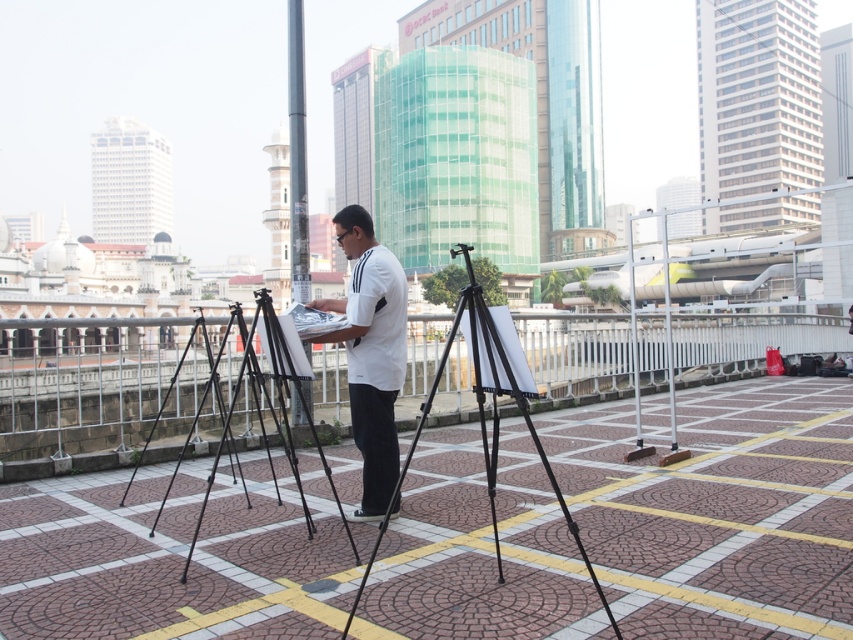
Is white matte shirt at center positioned behind black matte tripod at center?

Yes.

Does white matte shirt at center come in front of black matte tripod at center?

No, white matte shirt at center is behind black matte tripod at center.

Which is in front, point (368, 396) or point (592, 580)?

Point (592, 580) is more forward.

Where is `white matte shirt at center`? The image size is (853, 640). white matte shirt at center is located at coordinates (370, 353).

Who is taller, white matte shirt at center or black metal tripod at center?

With more height is white matte shirt at center.

Can you confirm if white matte shirt at center is taller than black metal tripod at center?

Indeed, white matte shirt at center has a greater height compared to black metal tripod at center.

Between point (372, 308) and point (276, 378), which one is positioned in front?

Point (372, 308) is more forward.

I want to click on white matte shirt at center, so click(x=370, y=353).

Does black metal tripod at center appear on the left side of black metal pole at center?

In fact, black metal tripod at center is to the right of black metal pole at center.

Looking at this image, can you confirm if black metal tripod at center is smaller than black metal pole at center?

Correct, black metal tripod at center occupies less space than black metal pole at center.

Which is in front, point (161, 500) or point (297, 200)?

Positioned in front is point (161, 500).

What are the coordinates of `black metal tripod at center` in the screenshot? It's located at (270, 408).